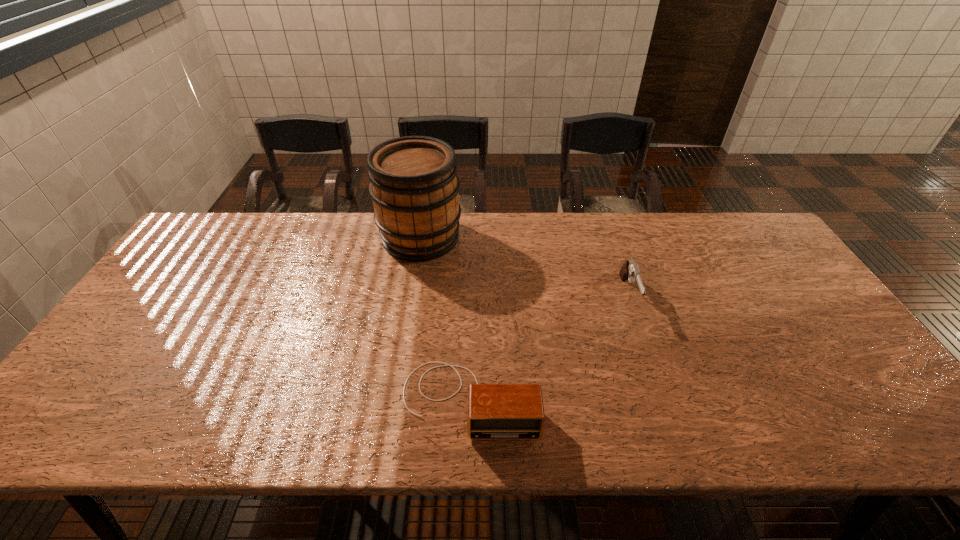
In the image, there is a desktop. Identify the location of free space at the left edge. (159, 284).

The width and height of the screenshot is (960, 540). Identify the location of vacant space at the far left corner of the desktop. (224, 254).

You are a GUI agent. You are given a task and a screenshot of the screen. Output one action in this format:
    pyautogui.click(x=<x>, y=<y>)
    Task: Click on the vacant point located between the tallest object and the rightmost object
    The image size is (960, 540).
    Given the screenshot: What is the action you would take?
    pyautogui.click(x=525, y=266)

Find the location of a particular element. The width and height of the screenshot is (960, 540). vacant area that lies between the radio receiver and the tallest object is located at coordinates (445, 318).

Identify the location of vacant area between the second farthest object and the tallest object. The width and height of the screenshot is (960, 540). (525, 266).

The height and width of the screenshot is (540, 960). Identify the location of vacant region between the second nearest object and the cider. click(x=525, y=266).

The width and height of the screenshot is (960, 540). I want to click on free space between the tallest object and the nearest object, so click(445, 318).

Identify the location of free space between the nearest object and the cider. (445, 318).

This screenshot has width=960, height=540. Identify the location of free point between the nearest object and the cider. (445, 318).

This screenshot has height=540, width=960. Find the location of `free spot between the farthest object and the radio receiver`. free spot between the farthest object and the radio receiver is located at coordinates (445, 318).